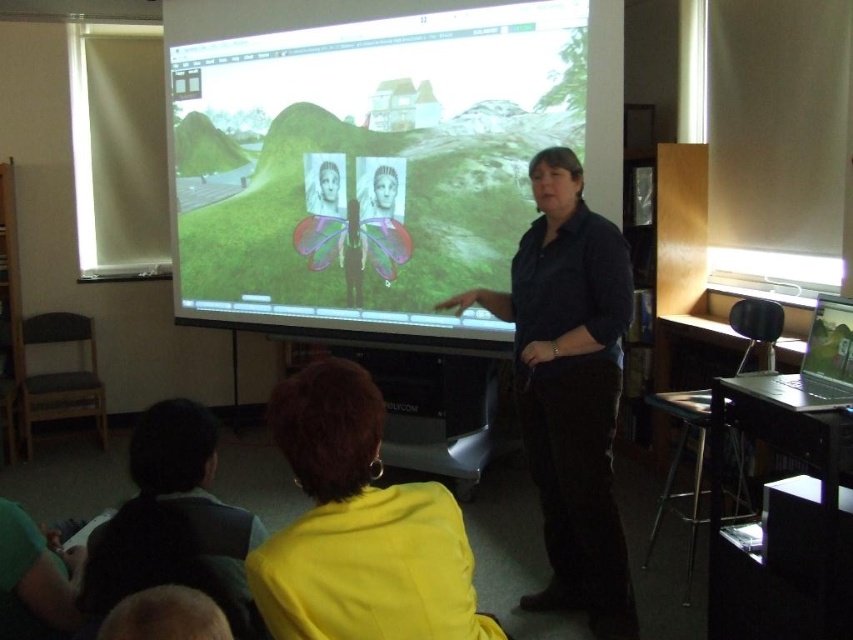
Question: Which of the following is the closest to the observer?

Choices:
 (A) (555, 323)
 (B) (213, 52)
 (C) (462, 624)

Answer: (C)

Question: Which object is the closest to the yellow fabric at lower center?

Choices:
 (A) dark blue shirt at center
 (B) matte white screen at center

Answer: (A)

Question: Does matte white screen at center have a larger size compared to dark blue shirt at center?

Choices:
 (A) yes
 (B) no

Answer: (A)

Question: Does matte white screen at center have a lesser width compared to yellow fabric at lower center?

Choices:
 (A) no
 (B) yes

Answer: (A)

Question: Which point appears farthest from the camera in this image?

Choices:
 (A) (300, 388)
 (B) (424, 173)

Answer: (B)

Question: Considering the relative positions of dark blue shirt at center and yellow fabric at lower center in the image provided, where is dark blue shirt at center located with respect to yellow fabric at lower center?

Choices:
 (A) below
 (B) above

Answer: (B)